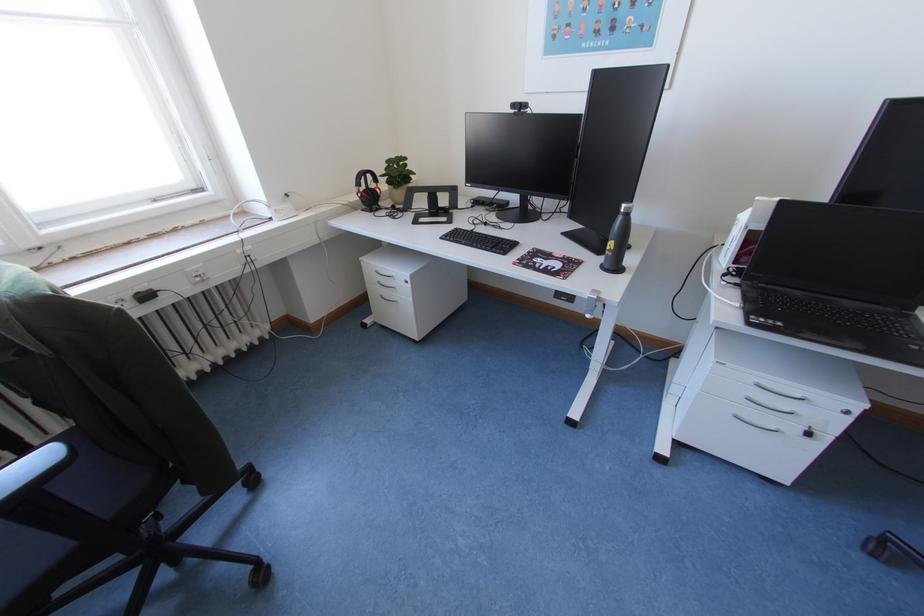
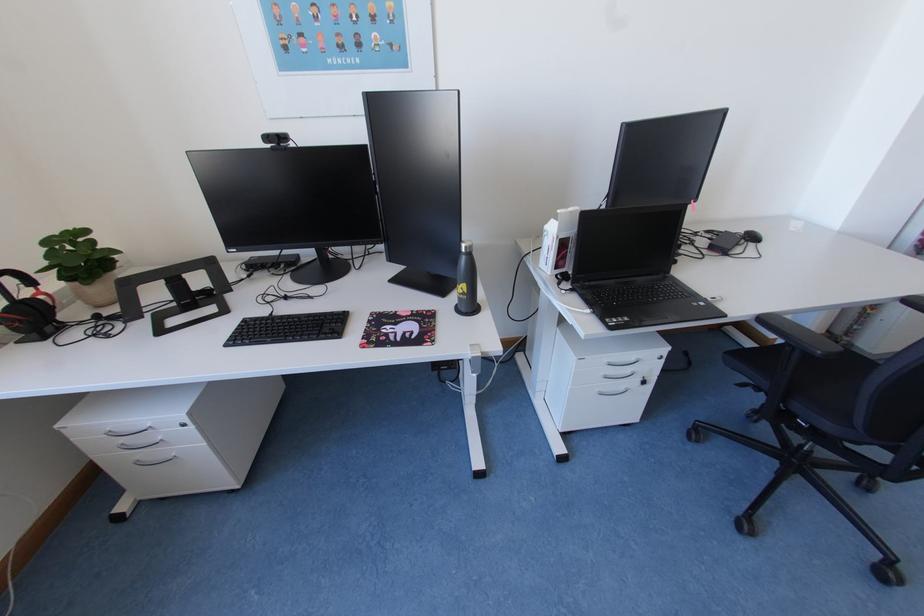
Question: Based on the continuous images, in which direction is the camera rotating? Reply with the corresponding letter.

Choices:
 (A) Left
 (B) Right
 (C) Up
 (D) Down

Answer: (B)